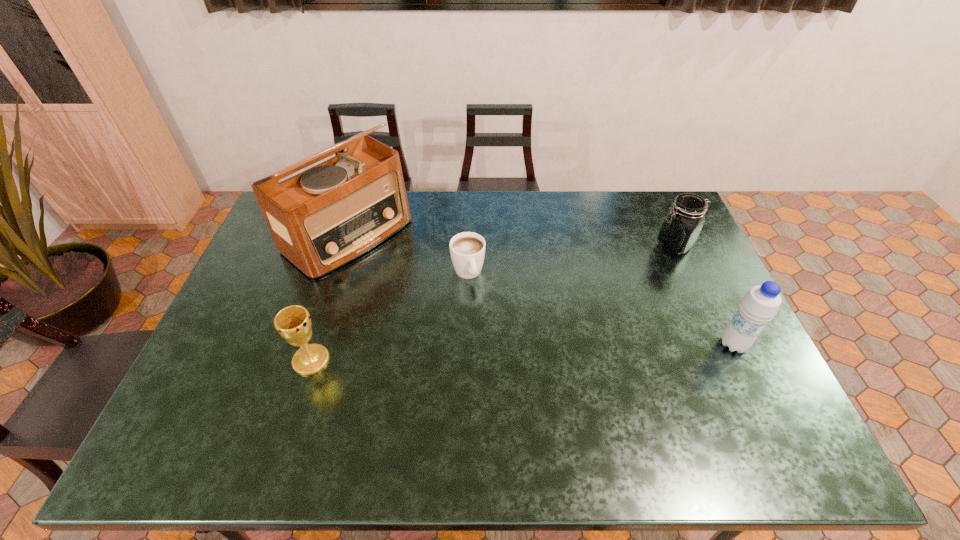
Identify the location of chalice. (293, 323).

Where is `the fourth shortest object`? This screenshot has height=540, width=960. the fourth shortest object is located at coordinates (761, 303).

Where is `jar`? jar is located at coordinates (680, 229).

Locate an element on the screen. This screenshot has height=540, width=960. the third object from left to right is located at coordinates (467, 249).

Locate an element on the screen. The width and height of the screenshot is (960, 540). cappuccino is located at coordinates pos(467,249).

Where is `radio receiver`? This screenshot has width=960, height=540. radio receiver is located at coordinates point(324,217).

Find the location of a particular element. free space located on the right of the chalice is located at coordinates (434, 360).

You are a GUI agent. You are given a task and a screenshot of the screen. Output one action in this format:
    pyautogui.click(x=<x>, y=<y>)
    Task: Click on the vacant space located on the left of the water bottle
    This screenshot has height=540, width=960.
    Given the screenshot: What is the action you would take?
    pyautogui.click(x=591, y=344)

You are a GUI agent. You are given a task and a screenshot of the screen. Output one action in this format:
    pyautogui.click(x=<x>, y=<y>)
    Task: Click on the blank space located on the lid of the jar
    The height and width of the screenshot is (540, 960).
    Given the screenshot: What is the action you would take?
    pyautogui.click(x=652, y=262)

At what (x,y) coordinates should I click in order to perform the action: click on free location located 0.320m on the lid of the jar. Please return your answer as a coordinate pair (x, y). Image resolution: width=960 pixels, height=540 pixels. Looking at the image, I should click on (602, 301).